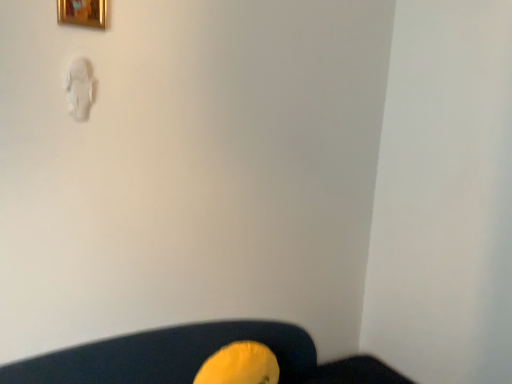
Question: From a real-world perspective, is yellow fabric bean bag chair at lower center above or below gold metallic picture frame at upper left?

Choices:
 (A) above
 (B) below

Answer: (B)

Question: In terms of width, does yellow fabric bean bag chair at lower center look wider or thinner when compared to gold metallic picture frame at upper left?

Choices:
 (A) wide
 (B) thin

Answer: (A)

Question: Would you say yellow fabric bean bag chair at lower center is to the left or to the right of gold metallic picture frame at upper left in the picture?

Choices:
 (A) left
 (B) right

Answer: (B)

Question: From their relative heights in the image, would you say gold metallic picture frame at upper left is taller or shorter than yellow fabric bean bag chair at lower center?

Choices:
 (A) tall
 (B) short

Answer: (B)

Question: Is gold metallic picture frame at upper left to the left or to the right of yellow fabric bean bag chair at lower center in the image?

Choices:
 (A) right
 (B) left

Answer: (B)

Question: Looking at the image, does gold metallic picture frame at upper left seem bigger or smaller compared to yellow fabric bean bag chair at lower center?

Choices:
 (A) big
 (B) small

Answer: (B)

Question: Do you think gold metallic picture frame at upper left is within yellow fabric bean bag chair at lower center, or outside of it?

Choices:
 (A) inside
 (B) outside

Answer: (B)